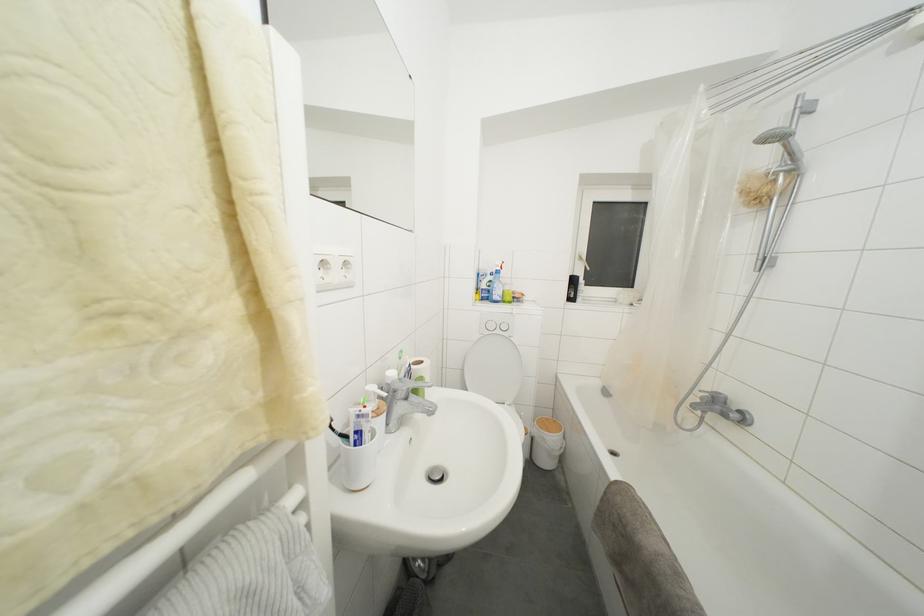
Image resolution: width=924 pixels, height=616 pixels. Describe the element at coordinates (549, 429) in the screenshot. I see `a wooden trash can lid` at that location.